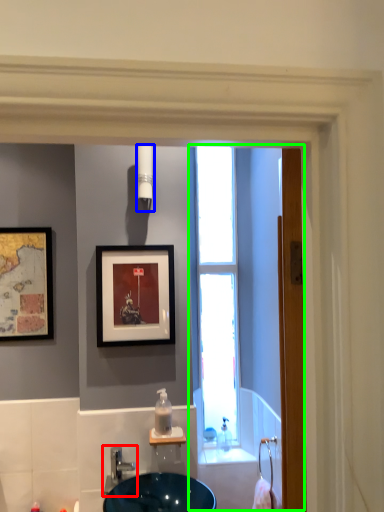
Question: Which object is positioned closest to tap (highlighted by a red box)? Select from light fixture (highlighted by a blue box) and screen door (highlighted by a green box).

Choices:
 (A) light fixture
 (B) screen door

Answer: (B)